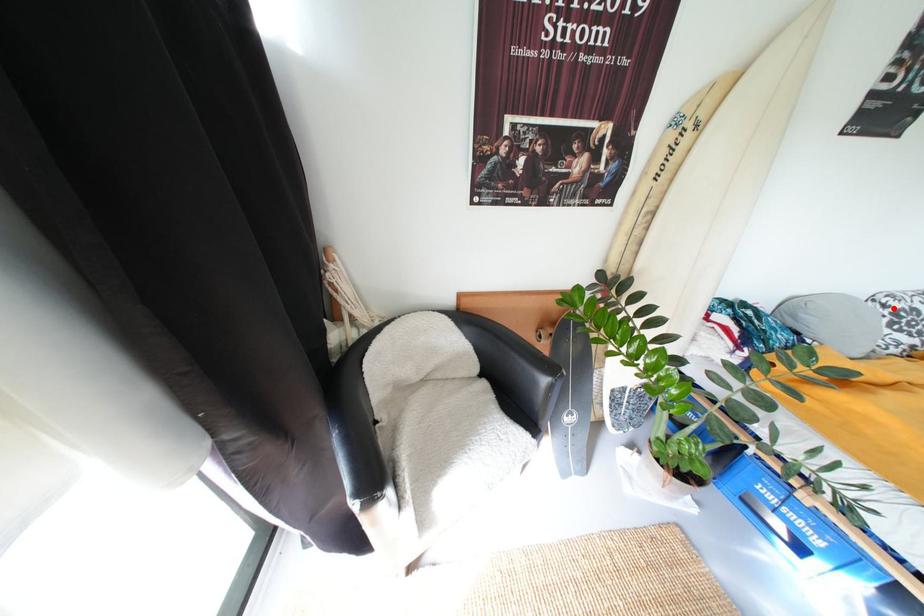
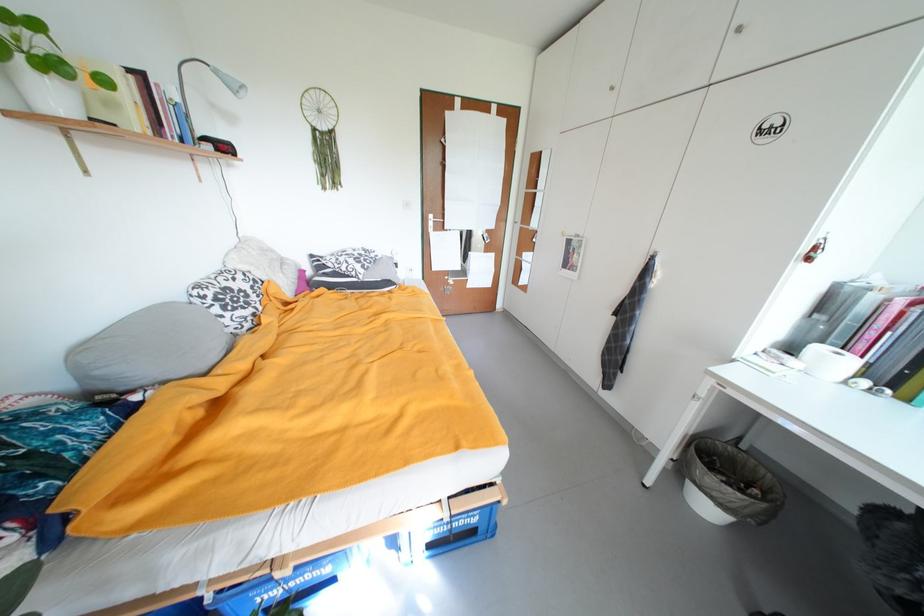
Find the pixel in the second image that matches the highlighted location in the first image.

(211, 299)